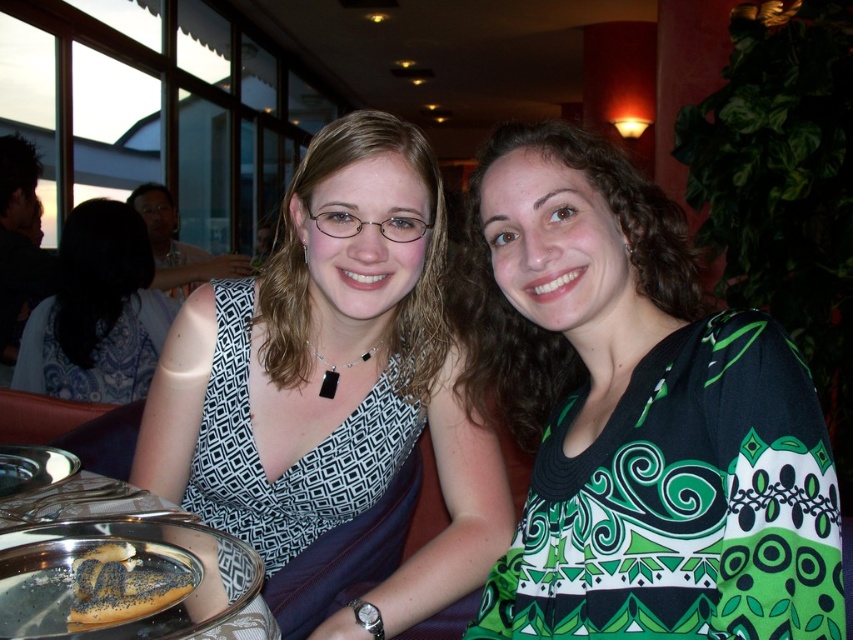
Question: Which of the following is the farthest from the observer?

Choices:
 (A) black printed fabric dress at center
 (B) brown poppy seed bagel at lower left
 (C) silver metallic plate at lower left

Answer: (A)

Question: Is black matte dress at center positioned in front of silver metallic plate at lower left?

Choices:
 (A) no
 (B) yes

Answer: (A)

Question: Which point is farther from the camera taking this photo?

Choices:
 (A) (114, 552)
 (B) (190, 632)
 (C) (376, 502)

Answer: (C)

Question: Is green printed dress at center to the left of matte black dress at center from the viewer's perspective?

Choices:
 (A) no
 (B) yes

Answer: (A)

Question: Which object appears closest to the camera in this image?

Choices:
 (A) silver metallic plate at lower left
 (B) silver metallic tray at lower left
 (C) brown poppy seed bagel at lower left

Answer: (B)

Question: Is green printed dress at center further to camera compared to silver metallic tray at lower left?

Choices:
 (A) yes
 (B) no

Answer: (A)